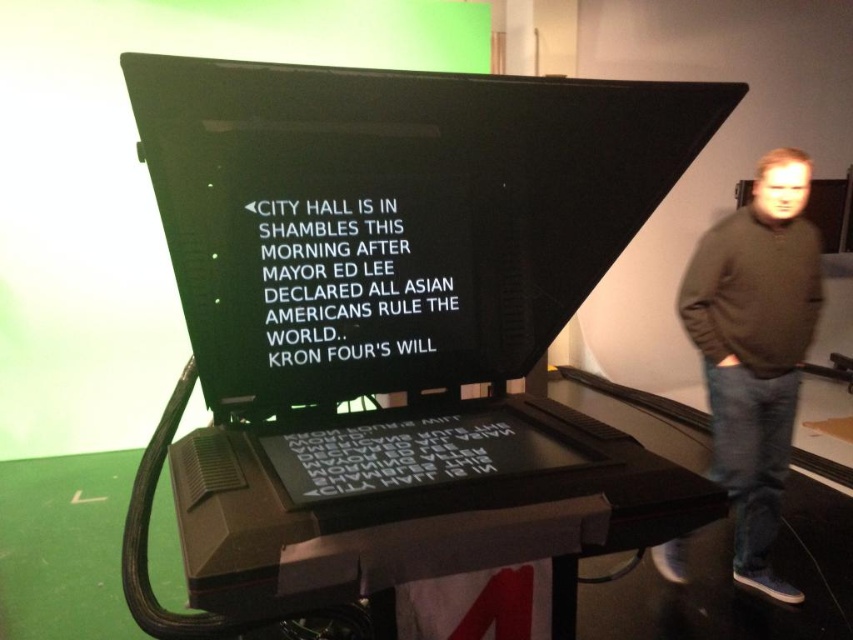
Does black plastic computer screen at center appear on the left side of brown sweater at right?

Yes, black plastic computer screen at center is to the left of brown sweater at right.

Does black plastic computer screen at center have a larger size compared to brown sweater at right?

Actually, black plastic computer screen at center might be smaller than brown sweater at right.

Does point (311, 369) come in front of point (756, 176)?

Yes, it is.

Find the location of `black plastic computer screen at center`. black plastic computer screen at center is located at coordinates (395, 214).